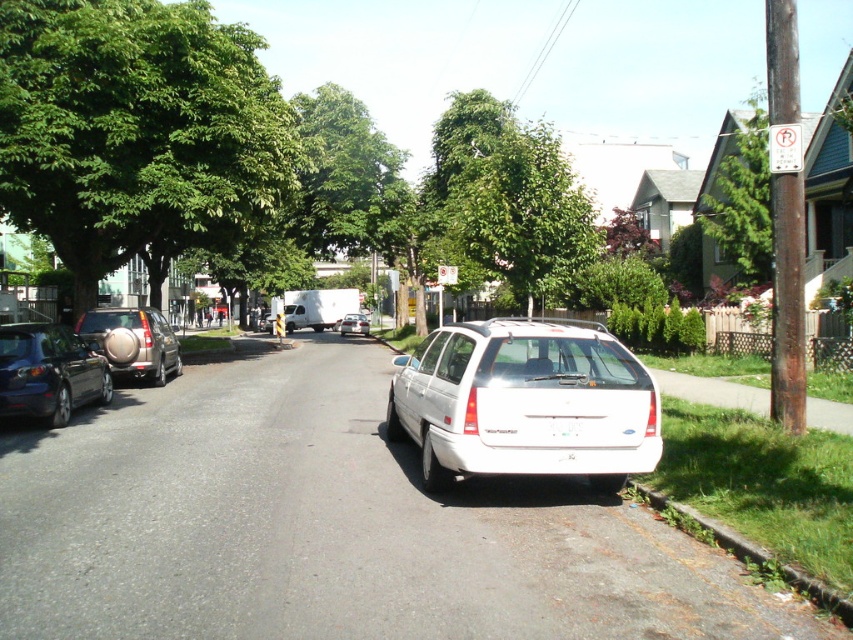
You are a gardener trying to place a new rectangular garden bed. You need to know which area is wider between the green grass at lower right and the white plastic license plate at center. Which one is wider?

The green grass at lower right is wider than the white plastic license plate at center according to the description.

You are a delivery driver who needs to park your vehicle in this residential area. You see the matte silver suv at left and the white plastic license plate at center. Which object takes up more space in the scene?

The matte silver suv at left is larger in size than the white plastic license plate at center, so the matte silver suv at left takes up more space in the scene.

You are a gardener who needs to mow the lawn. You see the green grass at lower right and the white plastic license plate at center. Which area requires attention first based on their heights?

The green grass at lower right requires attention first because it is shorter than the white plastic license plate at center, indicating it might need trimming to match the desired height.